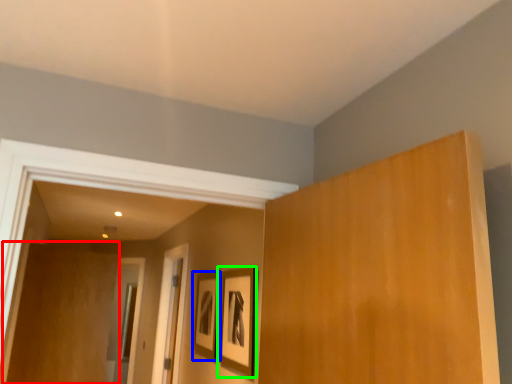
Question: Which object is positioned closest to plywood (highlighted by a red box)? Select from picture frame (highlighted by a blue box) and picture frame (highlighted by a green box).

Choices:
 (A) picture frame
 (B) picture frame

Answer: (A)